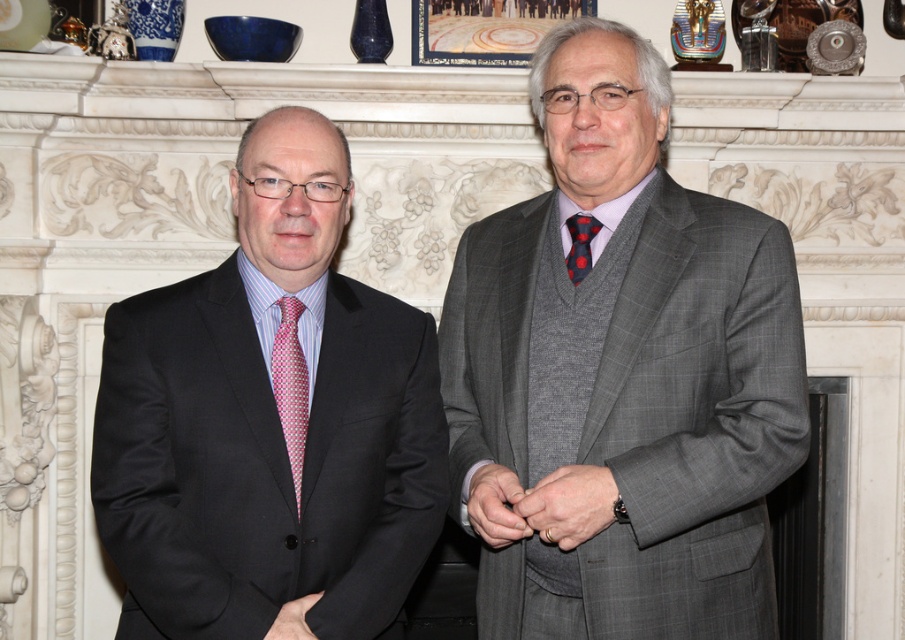
Two men are standing in a room. One is wearing a matte black suit at center. The other is wearing a gray checkered suit. How far apart are they?

The two men are 6.34 feet apart.

You are attending a formal event and need to decide which suit to wear. You see two options in the image, the matte black suit at center and the smooth gray suit at center. Which one is positioned to the left?

The matte black suit at center is positioned to the left of the smooth gray suit at center.

You are a photographer setting up a shoot. You need to ensure that the matte gray suit at center is visible above the matte black hand at center in the final image. Based on the scene description, will this arrangement naturally occur without any adjustments?

Yes, the matte gray suit at center is already positioned above the matte black hand at center according to the description, so no adjustments are needed.